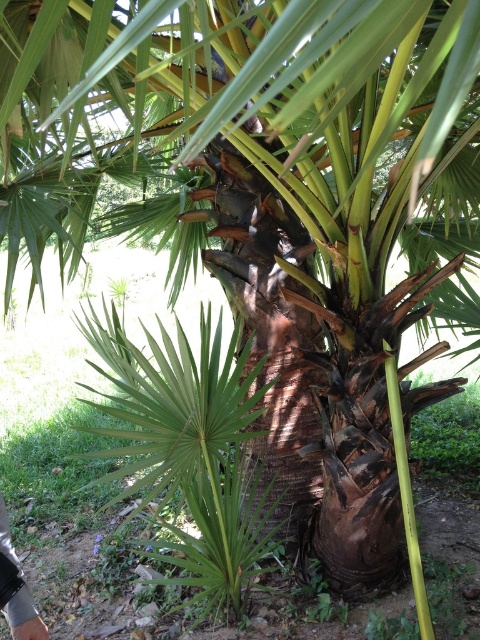
Question: Can you confirm if metallic silver glove at lower left is thinner than gray fabric hand at lower left?

Choices:
 (A) no
 (B) yes

Answer: (A)

Question: Which point is farther to the camera?

Choices:
 (A) (33, 634)
 (B) (19, 566)

Answer: (B)

Question: Is metallic silver glove at lower left smaller than gray fabric hand at lower left?

Choices:
 (A) no
 (B) yes

Answer: (A)

Question: Which object appears farthest from the camera in this image?

Choices:
 (A) gray fabric hand at lower left
 (B) metallic silver glove at lower left

Answer: (A)

Question: From the image, what is the correct spatial relationship of metallic silver glove at lower left in relation to gray fabric hand at lower left?

Choices:
 (A) above
 (B) below

Answer: (A)